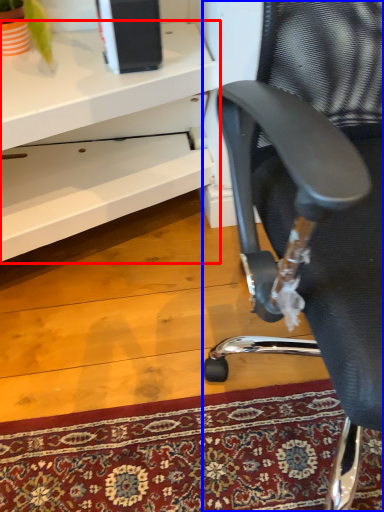
Question: Which of the following is the farthest to the observer, desk (highlighted by a red box) or chair (highlighted by a blue box)?

Choices:
 (A) desk
 (B) chair

Answer: (A)